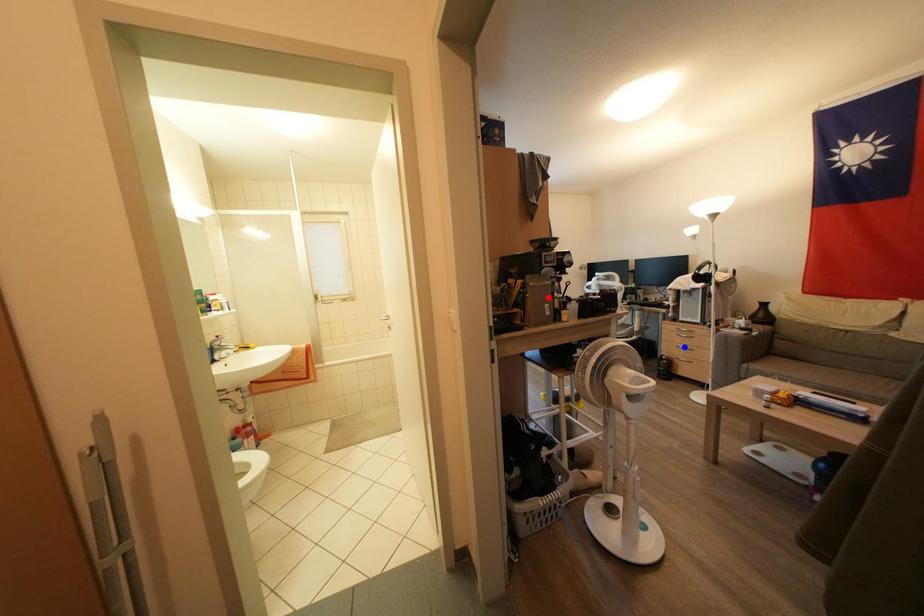
Question: Two points are marked on the image. Which point is closer to the camera?

Choices:
 (A) Blue point is closer.
 (B) Red point is closer.

Answer: (B)